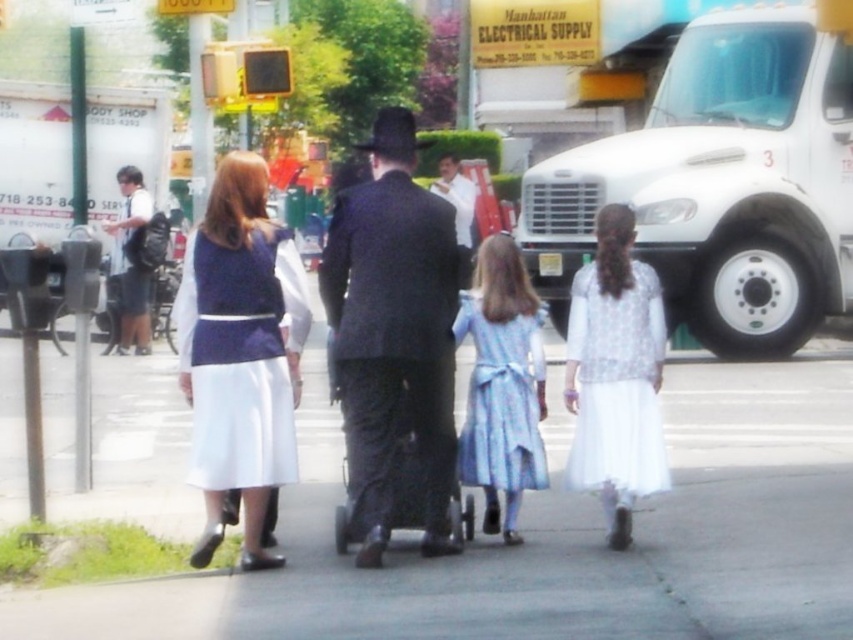
Question: Among these objects, which one is nearest to the camera?

Choices:
 (A) matte blue dress at center
 (B) gray concrete pavement at center
 (C) light blue satin dress at center

Answer: (B)

Question: Does white sheer dress at center have a smaller size compared to white cotton shirt at center?

Choices:
 (A) no
 (B) yes

Answer: (B)

Question: Can you confirm if matte blue dress at center is positioned to the left of white cotton shirt at center?

Choices:
 (A) no
 (B) yes

Answer: (B)

Question: Is white matte truck at right to the left of white satin dress at center from the viewer's perspective?

Choices:
 (A) no
 (B) yes

Answer: (A)

Question: Which of the following is the farthest from the observer?

Choices:
 (A) (759, 150)
 (B) (515, 488)
 (C) (573, 632)
 (D) (462, 180)

Answer: (D)

Question: Which object is the closest to the white shirt and shorts at left?

Choices:
 (A) white sheer dress at center
 (B) gray concrete pavement at center
 (C) white cotton shirt at center
 (D) dark gray suit at center

Answer: (C)